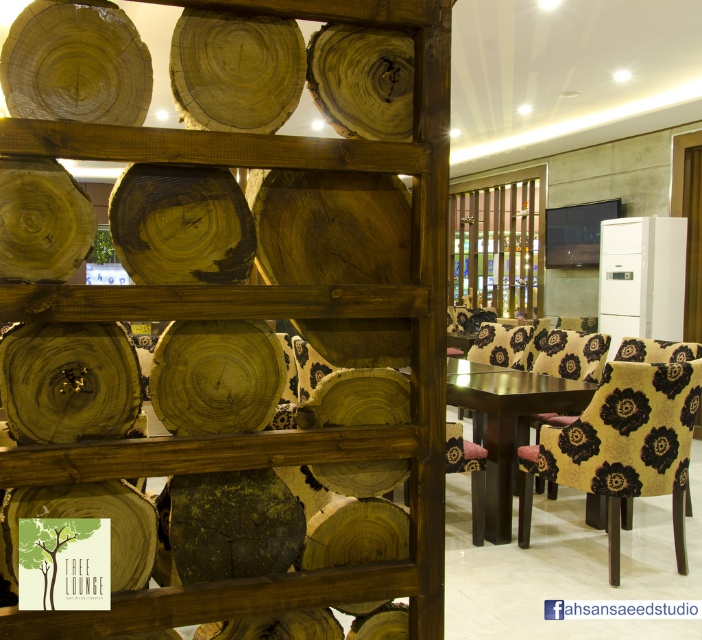
Which is more to the right, yellow floral fabric chair at center or patterned fabric chair at center?

yellow floral fabric chair at center

Which of these two, yellow floral fabric chair at center or patterned fabric chair at center, stands taller?

Standing taller between the two is yellow floral fabric chair at center.

Locate an element on the screen. Image resolution: width=702 pixels, height=640 pixels. yellow floral fabric chair at center is located at coordinates (571, 355).

This screenshot has width=702, height=640. What are the coordinates of `yellow floral fabric chair at center` in the screenshot? It's located at click(x=571, y=355).

Describe the element at coordinates (622, 445) in the screenshot. This screenshot has width=702, height=640. I see `yellow floral fabric chair at right` at that location.

Can you confirm if yellow floral fabric chair at right is positioned below yellow floral fabric chair at center?

Yes, yellow floral fabric chair at right is below yellow floral fabric chair at center.

Measure the distance between point (602, 432) and camera.

Point (602, 432) and camera are 2.91 meters apart.

I want to click on yellow floral fabric chair at right, so click(x=622, y=445).

Does dark brown wooden table at center have a lesser width compared to yellow floral fabric chair at center?

No, dark brown wooden table at center is not thinner than yellow floral fabric chair at center.

Does point (509, 429) come farther from viewer compared to point (550, 349)?

No, it is in front of (550, 349).

Find the location of `dark brown wooden table at center`. dark brown wooden table at center is located at coordinates (508, 422).